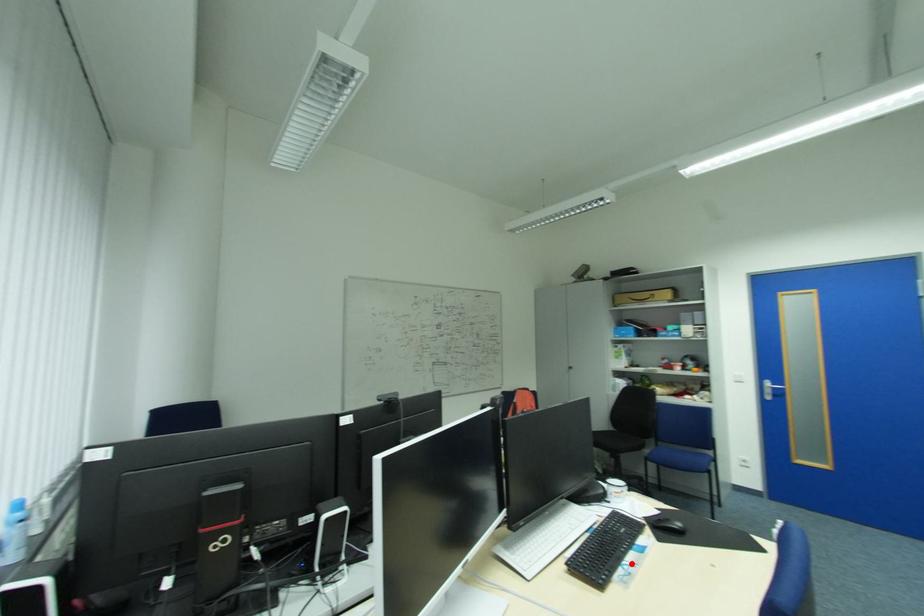
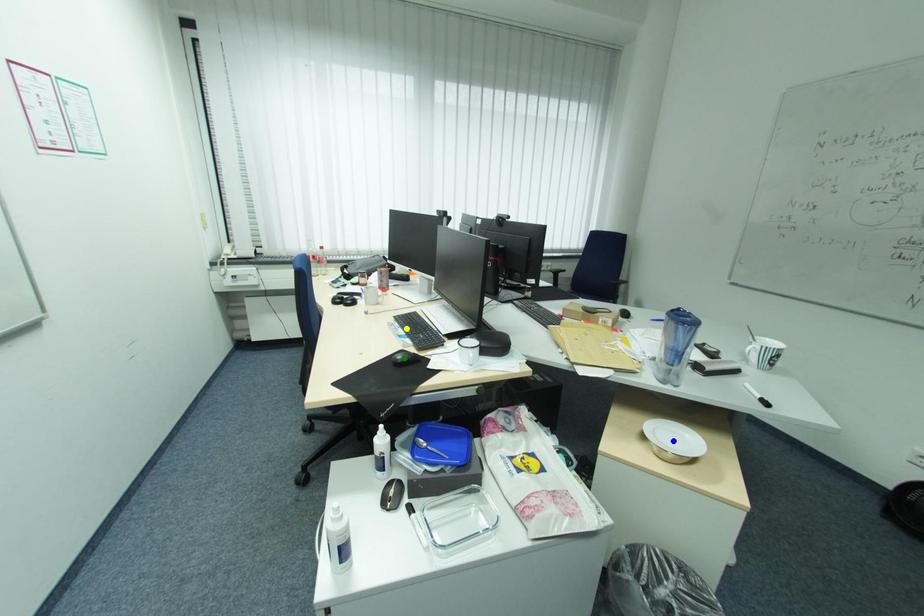
Question: I am providing you with two images of the same scene from different viewpoints. A red point is marked on the first image. You are given multiple points on the second image. Which mark in image 2 goes with the point in image 1?

Choices:
 (A) green point
 (B) blue point
 (C) yellow point

Answer: (C)